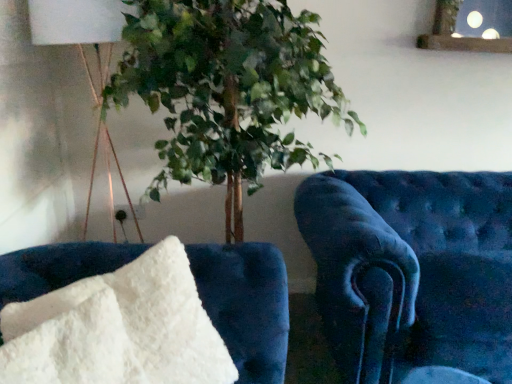
Question: Based on their sizes in the image, would you say velvet blue armchair at right, arranged as the second furniture when viewed from the left, is bigger or smaller than white fabric lampshade at upper left?

Choices:
 (A) big
 (B) small

Answer: (A)

Question: In the image, is velvet blue armchair at right, positioned as the second furniture in front-to-back order, positioned in front of or behind white fabric lampshade at upper left?

Choices:
 (A) behind
 (B) front

Answer: (B)

Question: Which object is the closest to the white fluffy pillow at lower left, which is the 2th furniture in right-to-left order?

Choices:
 (A) velvet blue armchair at right, placed as the 1th furniture when sorted from back to front
 (B) white fabric lampshade at upper left

Answer: (A)

Question: Estimate the real-world distances between objects in this image. Which object is farther from the white fluffy pillow at lower left, the second furniture when ordered from back to front?

Choices:
 (A) velvet blue armchair at right, positioned as the second furniture in front-to-back order
 (B) white fabric lampshade at upper left

Answer: (B)